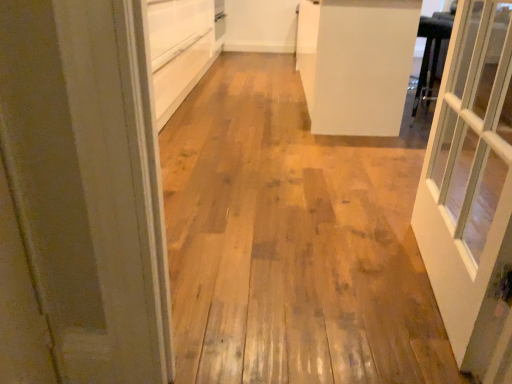
Find the location of a particular element. The height and width of the screenshot is (384, 512). white matte cabinet at upper right is located at coordinates (356, 63).

What do you see at coordinates (356, 63) in the screenshot? The height and width of the screenshot is (384, 512). I see `white matte cabinet at upper right` at bounding box center [356, 63].

Locate an element on the screen. white matte cabinet at upper right is located at coordinates (356, 63).